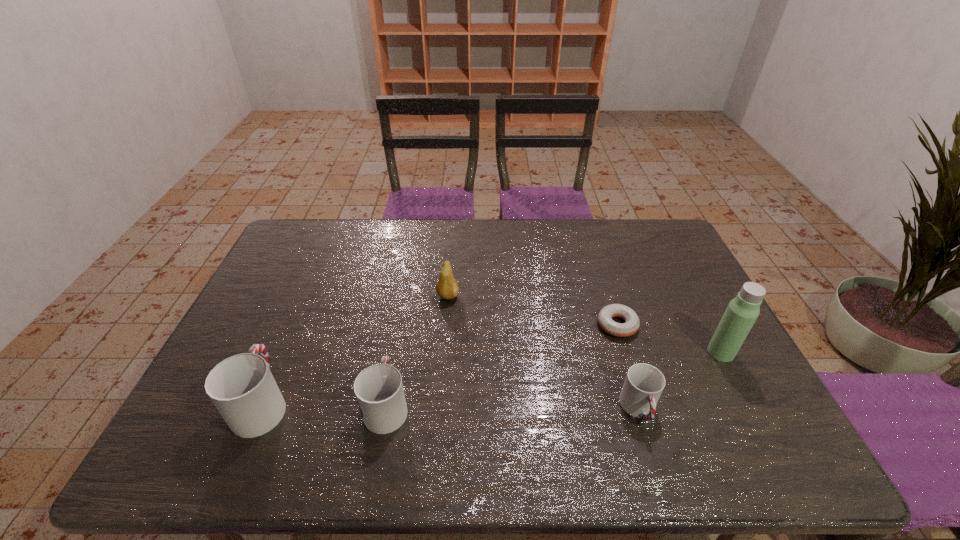
Locate an element on the screen. the leftmost cup is located at coordinates (242, 388).

The width and height of the screenshot is (960, 540). I want to click on the tallest cup, so click(x=242, y=388).

You are a GUI agent. You are given a task and a screenshot of the screen. Output one action in this format:
    pyautogui.click(x=<x>, y=<y>)
    Task: Click on the second tallest cup
    The width and height of the screenshot is (960, 540).
    Given the screenshot: What is the action you would take?
    pyautogui.click(x=379, y=391)

Where is `the second cup from left to right`? the second cup from left to right is located at coordinates (379, 391).

Locate an element on the screen. the rightmost cup is located at coordinates (644, 383).

This screenshot has width=960, height=540. I want to click on the fifth tallest object, so click(x=644, y=383).

I want to click on pear, so click(x=447, y=287).

Identify the location of the fourth object from right to left. This screenshot has width=960, height=540. tap(447, 287).

Find the location of `the rightmost object`. the rightmost object is located at coordinates (741, 313).

Identify the location of the third farthest object. (741, 313).